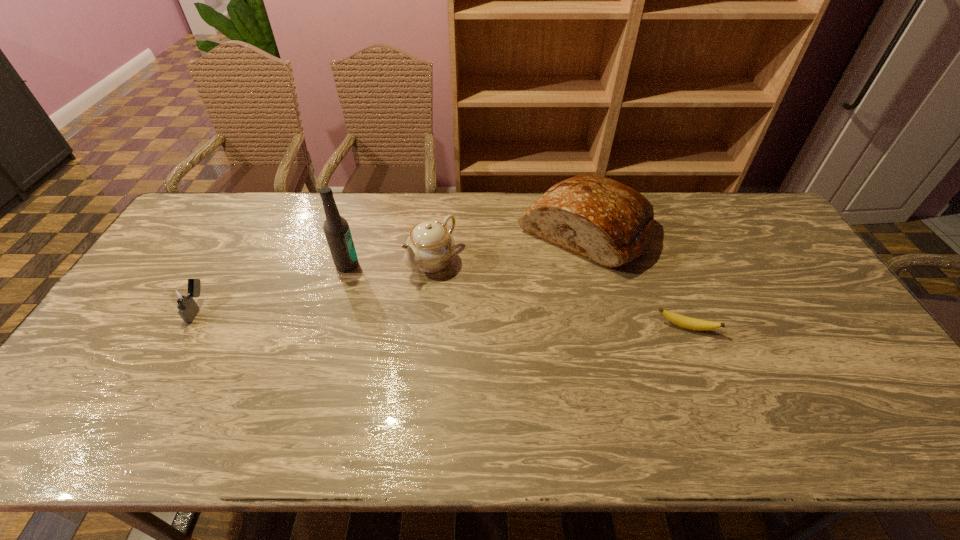
This screenshot has height=540, width=960. In order to click on empty location between the leftmost object and the chinaware in this screenshot , I will do `click(315, 284)`.

The width and height of the screenshot is (960, 540). I want to click on unoccupied position between the tallest object and the banana, so click(x=516, y=296).

Find the location of a particular element. Image resolution: width=960 pixels, height=540 pixels. vacant space that is in between the third object from right to left and the beer bottle is located at coordinates point(390,263).

This screenshot has width=960, height=540. Find the location of `vacant space in between the bread and the igniter`. vacant space in between the bread and the igniter is located at coordinates (391, 269).

Image resolution: width=960 pixels, height=540 pixels. I want to click on vacant space in between the second object from left to right and the bread, so click(x=466, y=248).

In order to click on the second closest object to the third shortest object in this screenshot , I will do `click(610, 223)`.

Find the location of a particular element. The image size is (960, 540). object that is the fourth closest one to the leftmost object is located at coordinates (683, 321).

I want to click on vacant position in the image that satisfies the following two spatial constraints: 1. on the back side of the beer bottle; 2. on the left side of the bread, so click(357, 231).

Locate an element on the screen. The width and height of the screenshot is (960, 540). free space in the image that satisfies the following two spatial constraints: 1. on the front side of the third tallest object; 2. on the right side of the shortest object is located at coordinates (424, 327).

This screenshot has width=960, height=540. Identify the location of free spot that satisfies the following two spatial constraints: 1. on the front side of the shortest object; 2. on the right side of the bread. (608, 327).